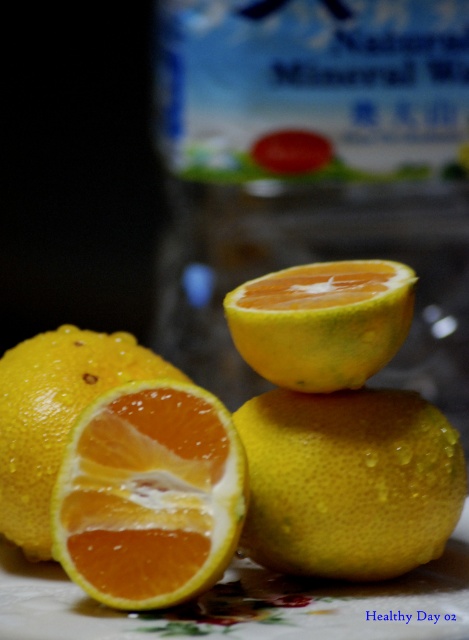
Question: Is glossy yellow orange at center in front of yellow matte orange at center?

Choices:
 (A) yes
 (B) no

Answer: (A)

Question: Can you confirm if semi-glossy orange at center is positioned below yellow matte orange at center?

Choices:
 (A) yes
 (B) no

Answer: (A)

Question: Which object is positioned farthest from the semi-glossy orange at center?

Choices:
 (A) yellow matte orange at center
 (B) smooth yellow grapefruit at lower left
 (C) spongy yellow grapefruit at center

Answer: (A)

Question: Based on their relative distances, which object is nearer to the smooth yellow grapefruit at lower left?

Choices:
 (A) semi-glossy orange at center
 (B) spongy yellow grapefruit at center
 (C) glossy yellow orange at center
 (D) yellow matte orange at center

Answer: (B)

Question: From the image, what is the correct spatial relationship of spongy yellow grapefruit at center in relation to smooth yellow grapefruit at lower left?

Choices:
 (A) above
 (B) below

Answer: (A)

Question: Which point is farther from the camera taking this photo?

Choices:
 (A) (303, 529)
 (B) (175, 408)

Answer: (A)